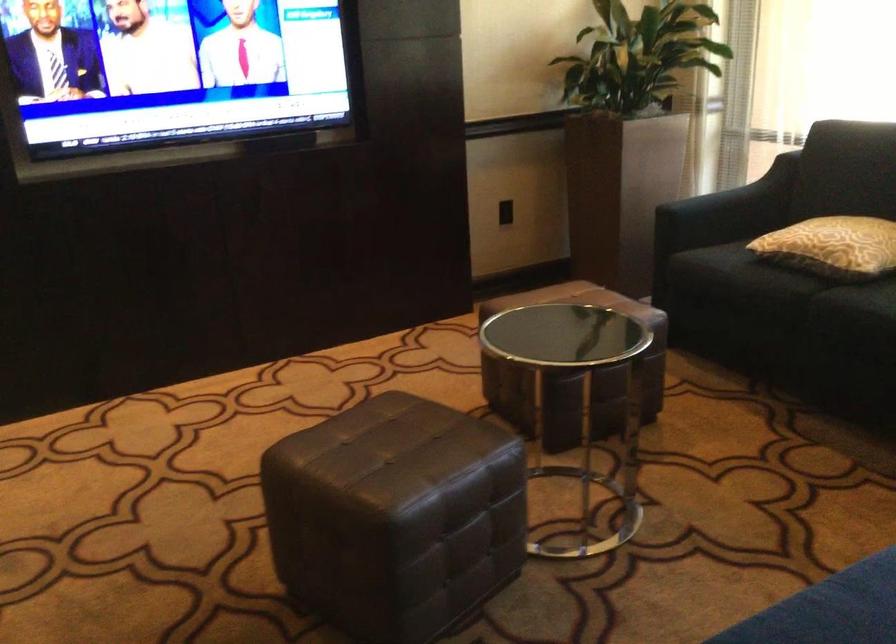
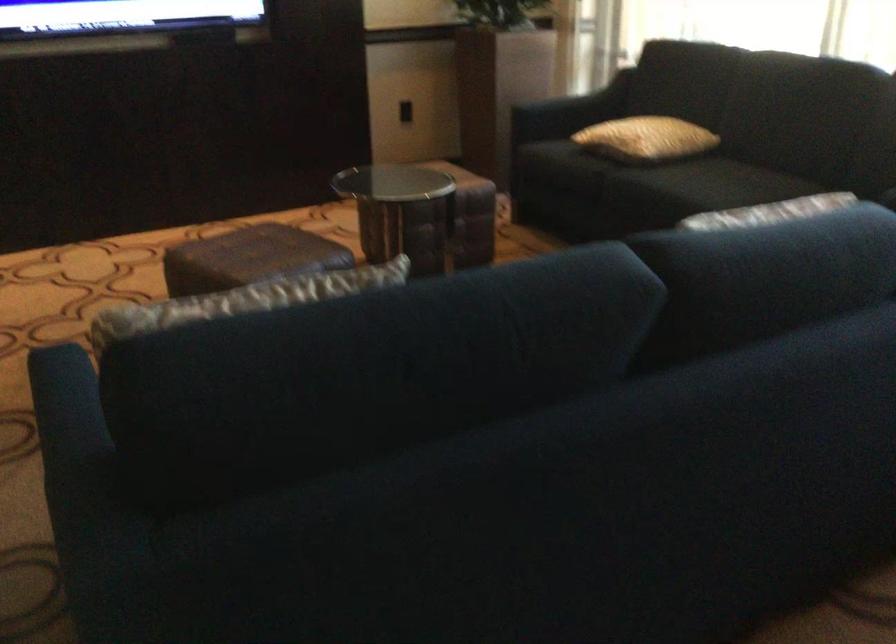
Find the pixel in the second image that matches [372,459] in the first image.

(248, 258)